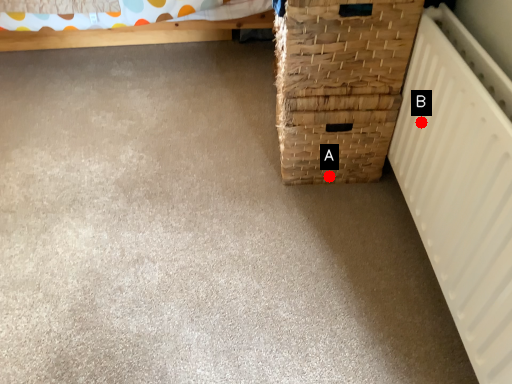
Question: Two points are circled on the image, labeled by A and B beside each circle. Which of the following is the closest to the observer?

Choices:
 (A) A is closer
 (B) B is closer

Answer: (B)